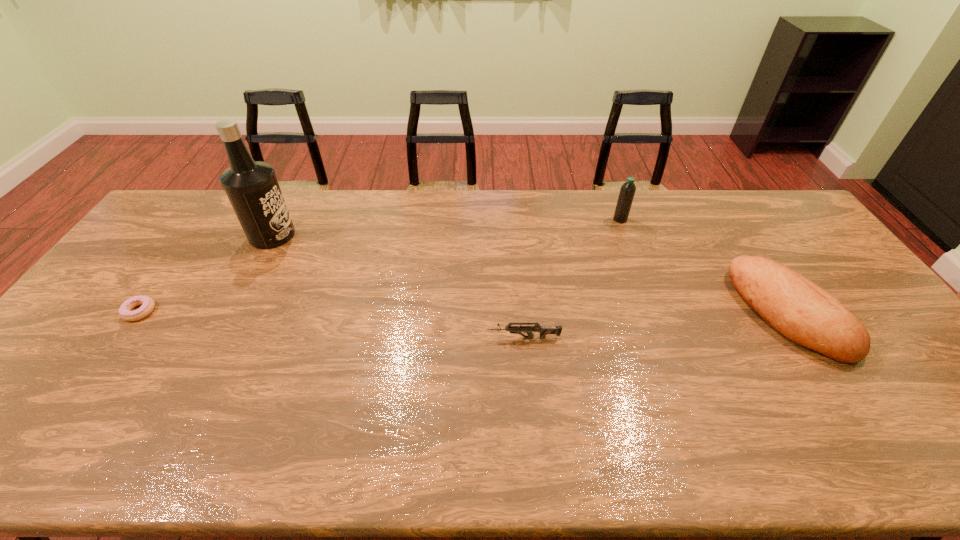
I want to click on object positioned at the right edge, so click(797, 308).

This screenshot has height=540, width=960. Find the location of `free space at the far edge`. free space at the far edge is located at coordinates (458, 210).

You are a GUI agent. You are given a task and a screenshot of the screen. Output one action in this format:
    pyautogui.click(x=<x>, y=<y>)
    Task: Click on the free space at the near edge
    The height and width of the screenshot is (540, 960).
    Given the screenshot: What is the action you would take?
    coord(470,429)

Locate an element on the screen. The image size is (960, 540). free location at the left edge of the desktop is located at coordinates (x=145, y=246).

Where is `vacant space at the right edge`? vacant space at the right edge is located at coordinates (787, 266).

In the image, there is a desktop. Where is `vacant area at the far left corner`? vacant area at the far left corner is located at coordinates (180, 207).

The width and height of the screenshot is (960, 540). Identify the location of empty space between the rightmost object and the tallest object. (530, 274).

The image size is (960, 540). In order to click on free space between the third object from right to left and the fourth shortest object in this screenshot , I will do `click(572, 279)`.

Identify the location of vacant area between the doughnut and the bread. The width and height of the screenshot is (960, 540). (464, 312).

I want to click on unoccupied area between the liquor and the rightmost object, so click(x=530, y=274).